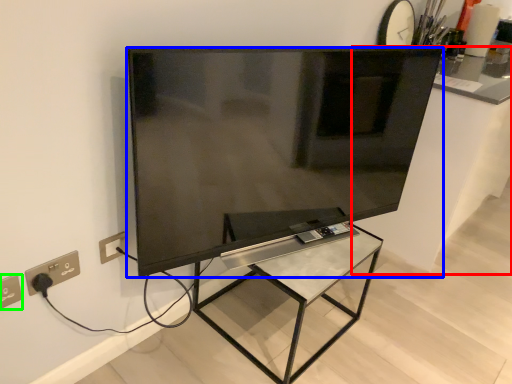
Question: Which is nearer to the counter top (highlighted by a red box)? television (highlighted by a blue box) or electric outlet (highlighted by a green box).

Choices:
 (A) television
 (B) electric outlet

Answer: (A)